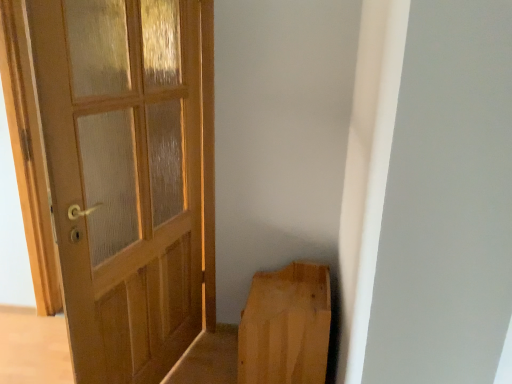
Question: In the image, is light brown wood at lower right on the left side or the right side of wooden door at left?

Choices:
 (A) right
 (B) left

Answer: (A)

Question: Is light brown wood at lower right situated inside wooden door at left or outside?

Choices:
 (A) outside
 (B) inside

Answer: (A)

Question: From their relative heights in the image, would you say light brown wood at lower right is taller or shorter than wooden door at left?

Choices:
 (A) short
 (B) tall

Answer: (A)

Question: From their relative heights in the image, would you say wooden door at left is taller or shorter than light brown wood at lower right?

Choices:
 (A) short
 (B) tall

Answer: (B)

Question: Do you think wooden door at left is within light brown wood at lower right, or outside of it?

Choices:
 (A) inside
 (B) outside

Answer: (B)

Question: Based on their sizes in the image, would you say wooden door at left is bigger or smaller than light brown wood at lower right?

Choices:
 (A) small
 (B) big

Answer: (B)

Question: Considering the positions of wooden door at left and light brown wood at lower right in the image, is wooden door at left wider or thinner than light brown wood at lower right?

Choices:
 (A) thin
 (B) wide

Answer: (A)